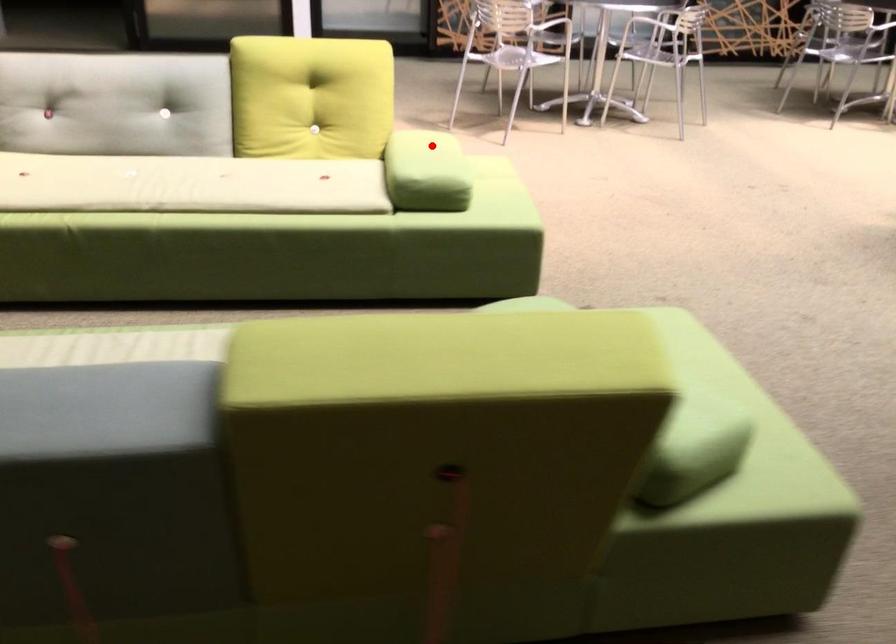
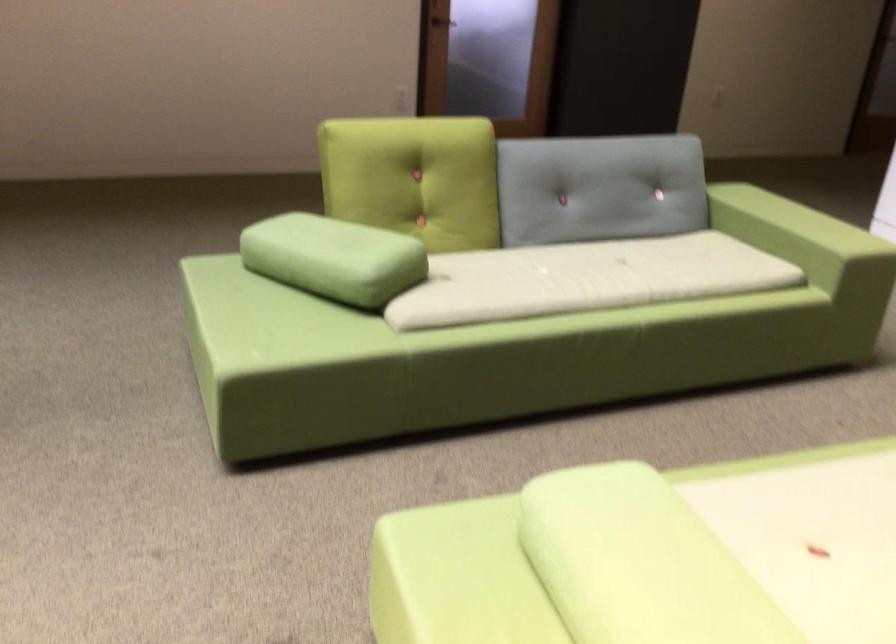
Find the pixel in the second image that matches the highlighted location in the first image.

(639, 563)